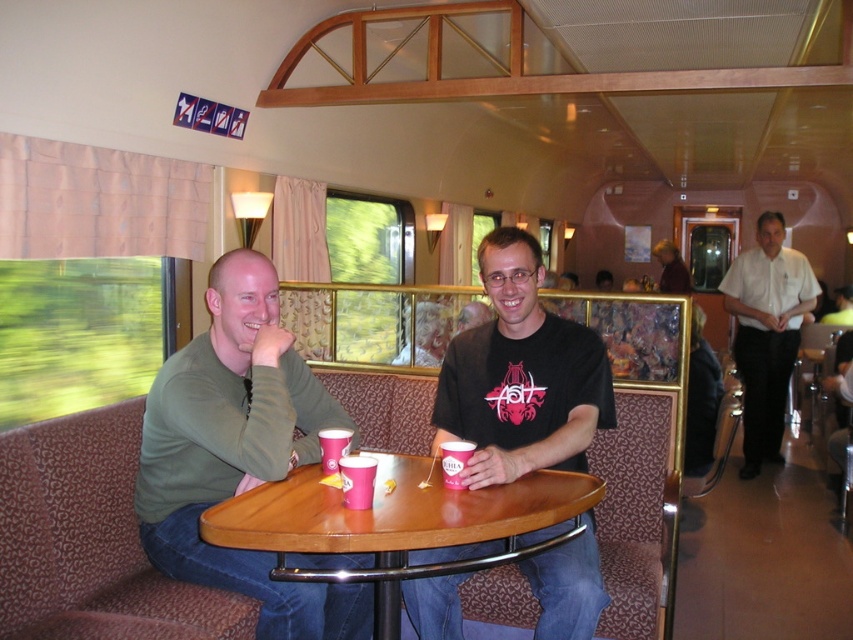
Can you confirm if green matte shirt at left is positioned above wooden table at center?

Yes.

Measure the distance between point (219, 275) and camera.

1.97 meters

At what (x,y) coordinates should I click in order to perform the action: click on green matte shirt at left. Please return your answer as a coordinate pair (x, y). Looking at the image, I should click on (238, 451).

Which of these two, green matte shirt at left or brown leather jacket at center, stands shorter?

With less height is brown leather jacket at center.

Between green matte shirt at left and brown leather jacket at center, which one is positioned lower?

green matte shirt at left is lower down.

Who is more distant from viewer, (293, 596) or (672, 262)?

Point (672, 262)

Image resolution: width=853 pixels, height=640 pixels. I want to click on green matte shirt at left, so click(x=238, y=451).

Is point (198, 552) behind point (457, 476)?

Yes, it is.

Who is more distant from viewer, [276,609] or [457,480]?

The point [276,609] is behind.

Does point (554, 456) lie in front of point (450, 461)?

No, (554, 456) is further to viewer.

The image size is (853, 640). I want to click on matte green shirt at center, so click(521, 376).